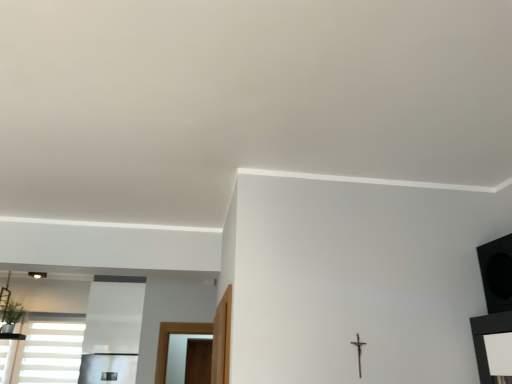
Question: Can white matte window at lower left be found inside metallic crucifix at center-right?

Choices:
 (A) yes
 (B) no

Answer: (B)

Question: Is metallic crucifix at center-right in front of white matte window at lower left?

Choices:
 (A) no
 (B) yes

Answer: (B)

Question: From a real-world perspective, is metallic crucifix at center-right located beneath white matte window at lower left?

Choices:
 (A) no
 (B) yes

Answer: (B)

Question: From a real-world perspective, is metallic crucifix at center-right on top of white matte window at lower left?

Choices:
 (A) yes
 (B) no

Answer: (B)

Question: Considering the relative sizes of metallic crucifix at center-right and white matte window at lower left in the image provided, is metallic crucifix at center-right smaller than white matte window at lower left?

Choices:
 (A) no
 (B) yes

Answer: (B)

Question: Considering the relative positions of metallic crucifix at center-right and white matte window at lower left in the image provided, is metallic crucifix at center-right to the left of white matte window at lower left from the viewer's perspective?

Choices:
 (A) no
 (B) yes

Answer: (A)

Question: Is white matte window at lower left positioned far away from metallic crucifix at center-right?

Choices:
 (A) yes
 (B) no

Answer: (A)

Question: Considering the relative positions of white matte window at lower left and metallic crucifix at center-right in the image provided, is white matte window at lower left to the left of metallic crucifix at center-right from the viewer's perspective?

Choices:
 (A) no
 (B) yes

Answer: (B)

Question: Considering the relative sizes of white matte window at lower left and metallic crucifix at center-right in the image provided, is white matte window at lower left shorter than metallic crucifix at center-right?

Choices:
 (A) no
 (B) yes

Answer: (A)

Question: Does white matte window at lower left touch metallic crucifix at center-right?

Choices:
 (A) no
 (B) yes

Answer: (A)

Question: From a real-world perspective, is white matte window at lower left on top of metallic crucifix at center-right?

Choices:
 (A) yes
 (B) no

Answer: (A)

Question: Can you confirm if white matte window at lower left is smaller than metallic crucifix at center-right?

Choices:
 (A) yes
 (B) no

Answer: (B)

Question: Is the position of green leafy plant at lower left more distant than that of metallic crucifix at center-right?

Choices:
 (A) yes
 (B) no

Answer: (A)